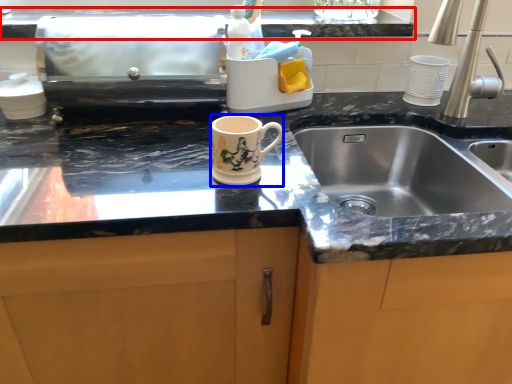
Question: Which point is further to the camera, countertop (highlighted by a red box) or mug (highlighted by a blue box)?

Choices:
 (A) countertop
 (B) mug

Answer: (A)